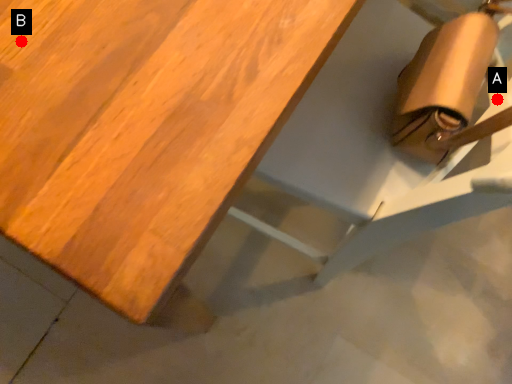
Question: Two points are circled on the image, labeled by A and B beside each circle. Which point appears closest to the camera in this image?

Choices:
 (A) A is closer
 (B) B is closer

Answer: (B)